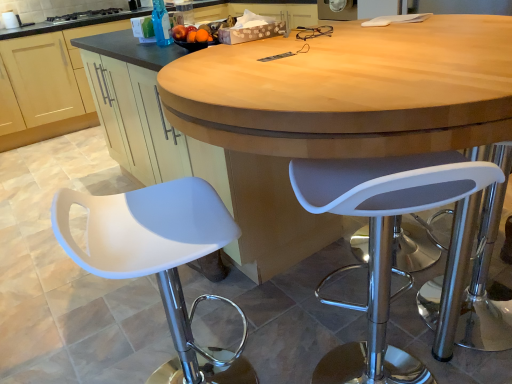
Locate an element on the screen. vacant location behind white matte stool at left, positioned as the first chair in left-to-right order is located at coordinates (198, 319).